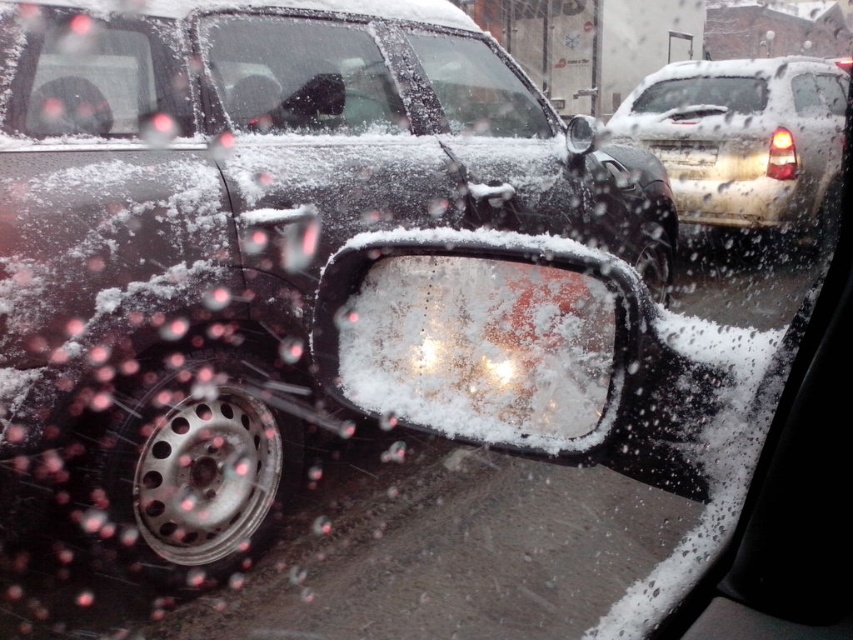
You are driving in a snowstorm and need to see the road ahead clearly. Which of the following should you clean first to improve visibility? The clear glass window at center or the clear glass windshield at center?

The clear glass windshield at center should be cleaned first because it is larger than the clear glass window at center, providing a broader view of the road ahead.

You are a driver trying to see the road ahead through the car window. Which of the two clear glass surfaces, the clear glass window at center or the clear glass windshield at center, would allow you to see a taller portion of the parked car outside?

The clear glass window at center is taller than the clear glass windshield at center, so it would allow you to see a taller portion of the parked car outside.

You are driving a car and need to check the road ahead. Where should you look on the windshield to see the clear glass window at center?

The clear glass window at center is located at the 2D coordinates point (300, 76) on the windshield.